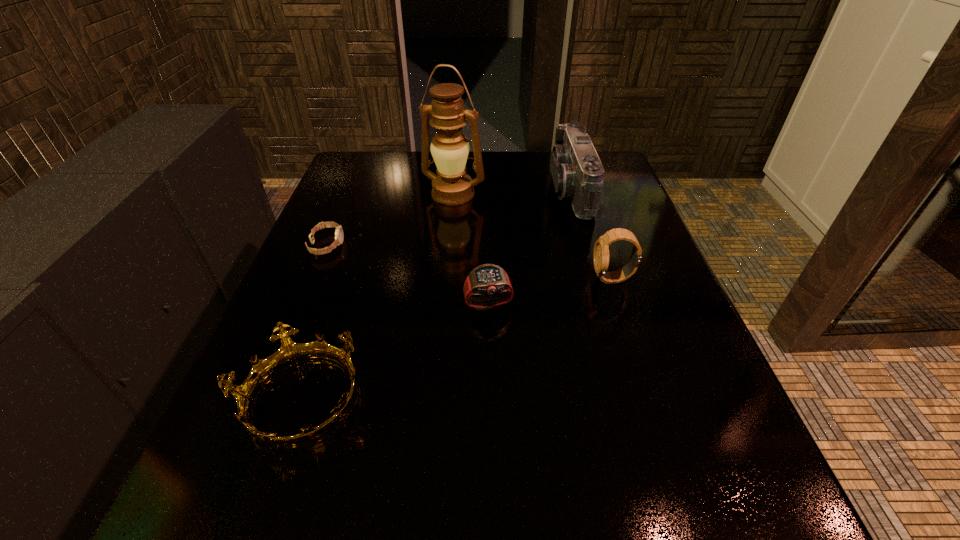
Find the location of a particular element. This screenshot has height=540, width=960. the tallest object is located at coordinates (451, 186).

Where is `camcorder`? camcorder is located at coordinates (578, 175).

Find the location of a particular element. The image size is (960, 540). the rightmost watch is located at coordinates (601, 249).

Where is `the second farthest watch`? the second farthest watch is located at coordinates (601, 249).

Find the location of `the nearest watch`. the nearest watch is located at coordinates (485, 279).

This screenshot has width=960, height=540. I want to click on the second watch from left to right, so click(485, 279).

You are a GUI agent. You are given a task and a screenshot of the screen. Output one action in this format:
    pyautogui.click(x=<x>, y=<y>)
    Task: Click on the nearest object
    The width and height of the screenshot is (960, 540).
    Given the screenshot: What is the action you would take?
    pyautogui.click(x=289, y=352)

Identify the location of the shortest watch. Image resolution: width=960 pixels, height=540 pixels. (339, 236).

Identify the location of the farthest watch. The width and height of the screenshot is (960, 540). (339, 236).

The image size is (960, 540). Identify the location of vacant area located 0.260m on the right of the tallest object. (588, 194).